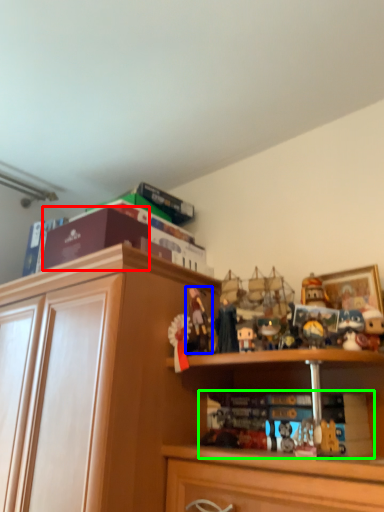
Question: Estimate the real-world distances between objects in this image. Which object is farther from book (highlighted by a red box), toy (highlighted by a blue box) or book (highlighted by a green box)?

Choices:
 (A) toy
 (B) book

Answer: (B)